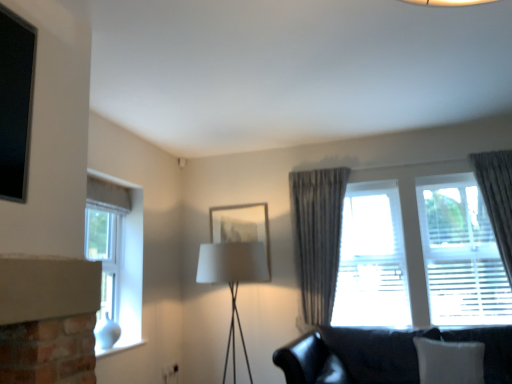
Question: From a real-world perspective, is white glass window at left, placed as the 2th window when sorted from right to left, physically located above or below white fabric lampshade at center?

Choices:
 (A) above
 (B) below

Answer: (A)

Question: Considering the positions of white glass window at left, the 1th window in the left-to-right sequence, and white fabric lampshade at center in the image, is white glass window at left, the 1th window in the left-to-right sequence, taller or shorter than white fabric lampshade at center?

Choices:
 (A) short
 (B) tall

Answer: (B)

Question: Estimate the real-world distances between objects in this image. Which object is closer to the white glass window at left, placed as the 2th window when sorted from right to left?

Choices:
 (A) white fabric pillow at lower right
 (B) textured gray curtain at center, which is the 1th curtain in left-to-right order
 (C) black leather couch at lower right
 (D) translucent fabric curtain at right, which is the second window in left-to-right order
 (E) matte glass picture frame at center

Answer: (E)

Question: Based on their relative distances, which object is farther from the silky gray curtain at right, which is the 1th curtain from right to left?

Choices:
 (A) translucent fabric curtain at right, the 1th window in the right-to-left sequence
 (B) white glass window at left, placed as the 2th window when sorted from right to left
 (C) matte glass picture frame at center
 (D) textured gray curtain at center, which is the second curtain in right-to-left order
 (E) white fabric pillow at lower right

Answer: (B)